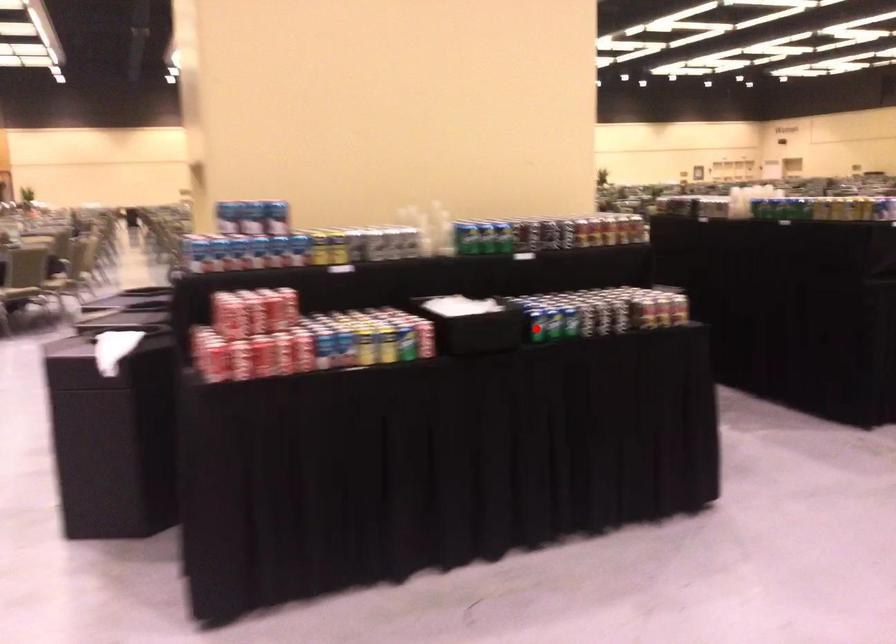
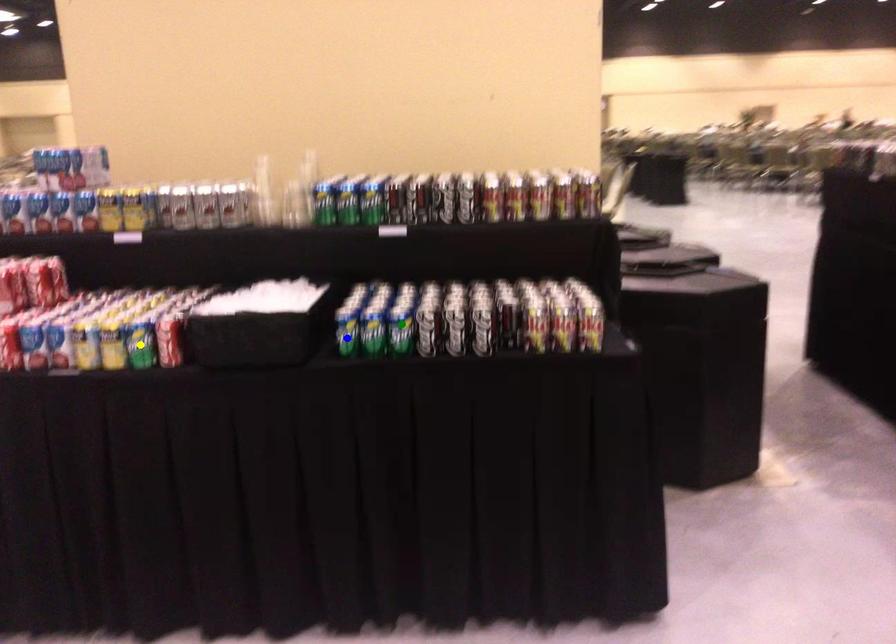
Question: I am providing you with two images of the same scene from different viewpoints. A red point is marked on the first image. You are given multiple points on the second image. Which spot in image 2 lines up with the point in image 1?

Choices:
 (A) green point
 (B) yellow point
 (C) blue point

Answer: (C)